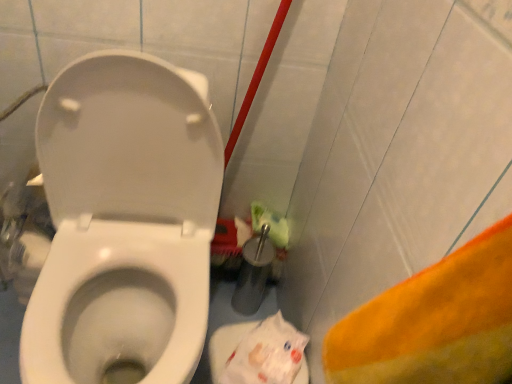
What do you see at coordinates (266, 354) in the screenshot? The image size is (512, 384). I see `white plastic bag at lower right` at bounding box center [266, 354].

Identify the location of white plastic bag at lower right. This screenshot has width=512, height=384. (266, 354).

What do you see at coordinates (124, 221) in the screenshot? Image resolution: width=512 pixels, height=384 pixels. I see `white glossy toilet at center` at bounding box center [124, 221].

Where is `white glossy toilet at center`? This screenshot has height=384, width=512. white glossy toilet at center is located at coordinates (124, 221).

At what (x,y) coordinates should I click in order to perform the action: click on white plastic bag at lower right. Please return your answer as a coordinate pair (x, y). The height and width of the screenshot is (384, 512). Looking at the image, I should click on (266, 354).

Based on their positions, is white glossy toilet at center located to the left or right of white plastic bag at lower right?

white glossy toilet at center is to the left of white plastic bag at lower right.

Which object is more forward, white glossy toilet at center or white plastic bag at lower right?

white glossy toilet at center is more forward.

Does point (143, 263) lie behind point (293, 356)?

Yes, it is.

From the image's perspective, which is below, white glossy toilet at center or white plastic bag at lower right?

white plastic bag at lower right.

From a real-world perspective, is white glossy toilet at center physically located above or below white plastic bag at lower right?

white glossy toilet at center is above white plastic bag at lower right.

Considering the sizes of objects white glossy toilet at center and white plastic bag at lower right in the image provided, who is wider, white glossy toilet at center or white plastic bag at lower right?

white glossy toilet at center.

Can you confirm if white glossy toilet at center is shorter than white plastic bag at lower right?

No, white glossy toilet at center is not shorter than white plastic bag at lower right.

Considering the relative sizes of white glossy toilet at center and white plastic bag at lower right in the image provided, is white glossy toilet at center smaller than white plastic bag at lower right?

No, white glossy toilet at center is not smaller than white plastic bag at lower right.

Is white glossy toilet at center positioned beyond the bounds of white plastic bag at lower right?

Yes, white glossy toilet at center is outside of white plastic bag at lower right.

From the picture: Are white glossy toilet at center and white plastic bag at lower right located far from each other?

No, white glossy toilet at center is in close proximity to white plastic bag at lower right.

Is white glossy toilet at center facing away from white plastic bag at lower right?

No, white glossy toilet at center's orientation is not away from white plastic bag at lower right.

Can you tell me how much white glossy toilet at center and white plastic bag at lower right differ in facing direction?

white glossy toilet at center and white plastic bag at lower right are facing 0.000218 degrees away from each other.

How much distance is there between white glossy toilet at center and white plastic bag at lower right?

white glossy toilet at center and white plastic bag at lower right are 13.87 inches apart from each other.

You are a GUI agent. You are given a task and a screenshot of the screen. Output one action in this format:
    pyautogui.click(x=<x>, y=<y>)
    Task: Click on the paper bag on the right of white glossy toilet at center
    This screenshot has height=384, width=512.
    Given the screenshot: What is the action you would take?
    pyautogui.click(x=266, y=354)

Which object is positioned more to the right, white plastic bag at lower right or white glossy toilet at center?

white plastic bag at lower right.

Considering the relative positions of white plastic bag at lower right and white glossy toilet at center in the image provided, is white plastic bag at lower right behind white glossy toilet at center?

Yes, white plastic bag at lower right is further from the viewer.

Is point (301, 351) closer or farther from the camera than point (60, 202)?

Point (301, 351) appears to be farther away from the viewer than point (60, 202).

From the image's perspective, is white plastic bag at lower right on top of white glossy toilet at center?

No.

In the scene shown: From a real-world perspective, is white plastic bag at lower right physically above white glossy toilet at center?

Actually, white plastic bag at lower right is physically below white glossy toilet at center in the real world.

Between white plastic bag at lower right and white glossy toilet at center, which one has smaller width?

Thinner between the two is white plastic bag at lower right.

Can you confirm if white plastic bag at lower right is shorter than white glossy toilet at center?

Indeed, white plastic bag at lower right has a lesser height compared to white glossy toilet at center.

Is white plastic bag at lower right bigger than white glossy toilet at center?

Actually, white plastic bag at lower right might be smaller than white glossy toilet at center.

Based on the photo, is white plastic bag at lower right not inside white glossy toilet at center?

Absolutely, white plastic bag at lower right is external to white glossy toilet at center.

Looking at this image, is there a large distance between white plastic bag at lower right and white glossy toilet at center?

That's not correct — white plastic bag at lower right is a little close to white glossy toilet at center.

Is white plastic bag at lower right oriented towards white glossy toilet at center?

No, white plastic bag at lower right does not turn towards white glossy toilet at center.

Based on the photo, how different are the orientations of white plastic bag at lower right and white glossy toilet at center in degrees?

white plastic bag at lower right and white glossy toilet at center are facing 0.000218 degrees away from each other.

Locate an element on the screen. The height and width of the screenshot is (384, 512). paper bag behind the white glossy toilet at center is located at coordinates [x=266, y=354].

The image size is (512, 384). In order to click on paper bag that is below the white glossy toilet at center (from the image's perspective) in this screenshot , I will do `click(266, 354)`.

Where is `paper bag on the right of white glossy toilet at center`? This screenshot has width=512, height=384. paper bag on the right of white glossy toilet at center is located at coordinates (266, 354).